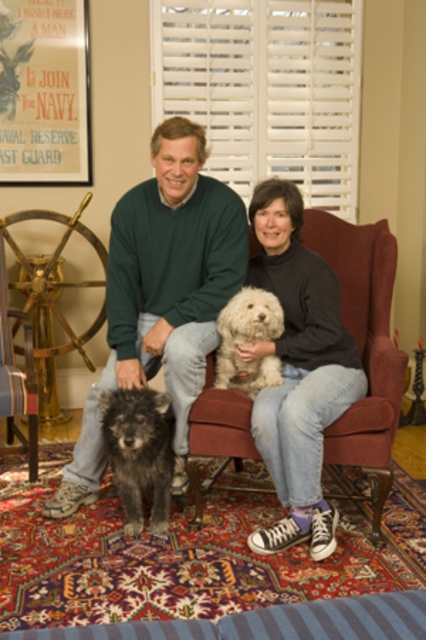
Is white fluffy dog at center below wooden armchair at lower left?

Incorrect, white fluffy dog at center is not positioned below wooden armchair at lower left.

Which is behind, point (219, 323) or point (31, 422)?

The point (31, 422) is more distant.

Locate an element on the screen. The height and width of the screenshot is (640, 426). white fluffy dog at center is located at coordinates (247, 340).

Which is more to the left, matte black turtleneck at center or striped fabric at lower center?

Positioned to the left is striped fabric at lower center.

Which of these two, matte black turtleneck at center or striped fabric at lower center, stands shorter?

Standing shorter between the two is striped fabric at lower center.

This screenshot has width=426, height=640. In order to click on matte black turtleneck at center in this screenshot , I will do `click(298, 371)`.

Between matte black turtleneck at center and fuzzy dark brown dog at lower left, which one is positioned higher?

matte black turtleneck at center

Is matte black turtleneck at center positioned in front of fuzzy dark brown dog at lower left?

Yes, it is in front of fuzzy dark brown dog at lower left.

Is point (299, 289) positioned in front of point (161, 492)?

No, it is not.

Locate an element on the screen. The image size is (426, 640). matte black turtleneck at center is located at coordinates (298, 371).